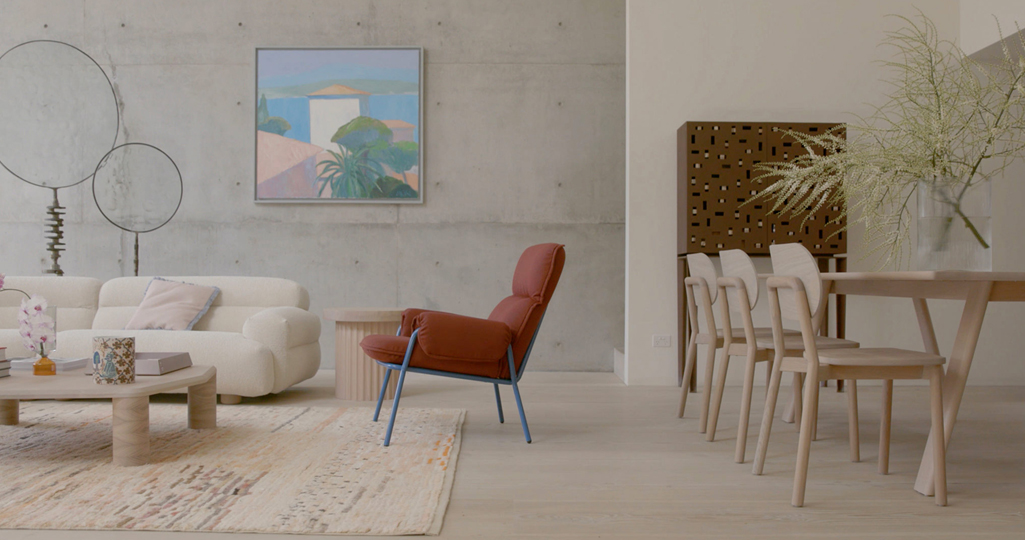
Identify the location of books. (1, 373), (4, 364), (3, 352).